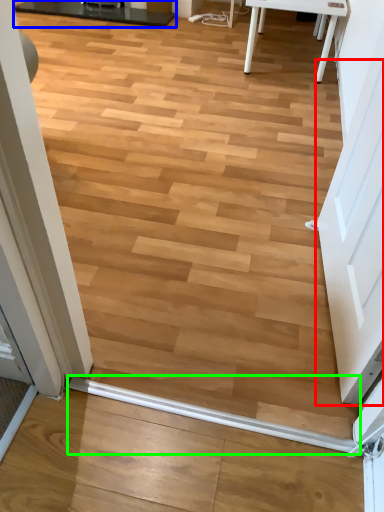
Question: Which object is positioned closest to screen door (highlighted by a red box)? Select from table (highlighted by a blue box) and beam (highlighted by a green box).

Choices:
 (A) table
 (B) beam

Answer: (B)